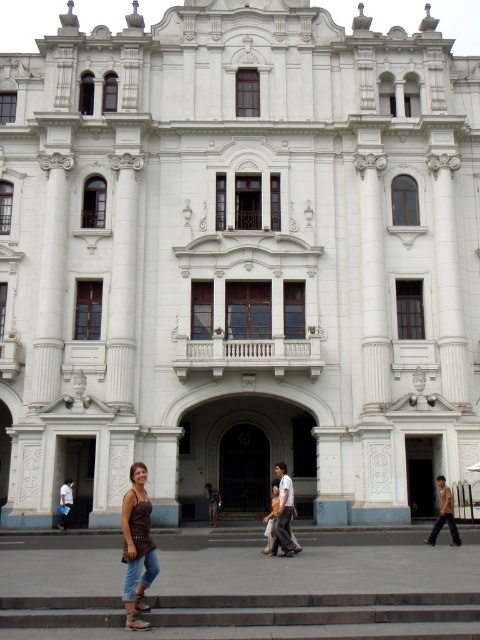
Question: Which point is closer to the camera taking this photo?

Choices:
 (A) (213, 486)
 (B) (287, 509)
 (C) (434, 532)
 (D) (19, 620)

Answer: (D)

Question: Which of the following is the farthest from the observer?

Choices:
 (A) (137, 550)
 (B) (284, 536)
 (C) (63, 497)
 (D) (440, 497)

Answer: (D)

Question: Which object appears farthest from the camera in this image?

Choices:
 (A) dark gray stone stairs at lower center
 (B) light brown leather jacket at lower right

Answer: (B)

Question: Is light brown leather jacket at lower right below white cotton shirt at lower left?

Choices:
 (A) yes
 (B) no

Answer: (A)

Question: Observing the image, what is the correct spatial positioning of dark gray stone stairs at lower center in reference to white cotton shirt at lower left?

Choices:
 (A) below
 (B) above

Answer: (B)

Question: Does white cotton shirt at lower left appear over denim pants at center?

Choices:
 (A) yes
 (B) no

Answer: (A)